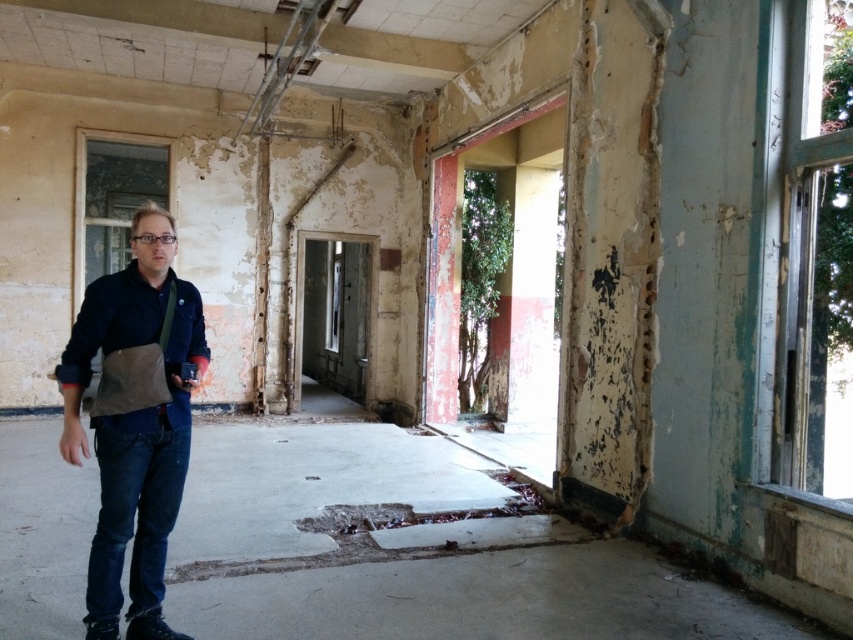
Does dark blue denim jacket at center have a smaller size compared to denim jacket at left?

Actually, dark blue denim jacket at center might be larger than denim jacket at left.

Between dark blue denim jacket at center and denim jacket at left, which one has more height?

dark blue denim jacket at center

Which is behind, point (169, 509) or point (135, 305)?

The point (169, 509) is behind.

The image size is (853, 640). I want to click on dark blue denim jacket at center, so click(x=135, y=424).